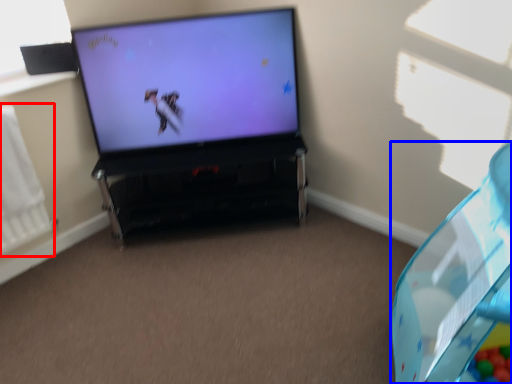
Question: Which object is further to the camera taking this photo, radiator (highlighted by a red box) or bean bag chair (highlighted by a blue box)?

Choices:
 (A) radiator
 (B) bean bag chair

Answer: (A)